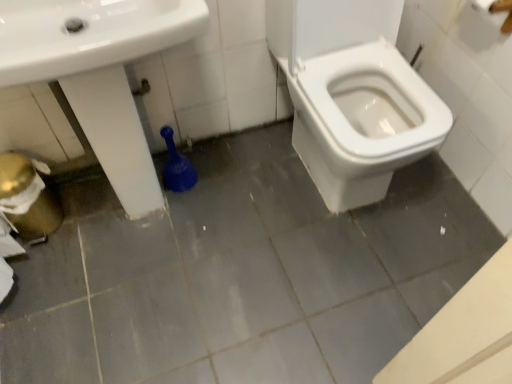
Locate an element on the screen. vacant space to the left of white glossy toilet at center is located at coordinates (251, 177).